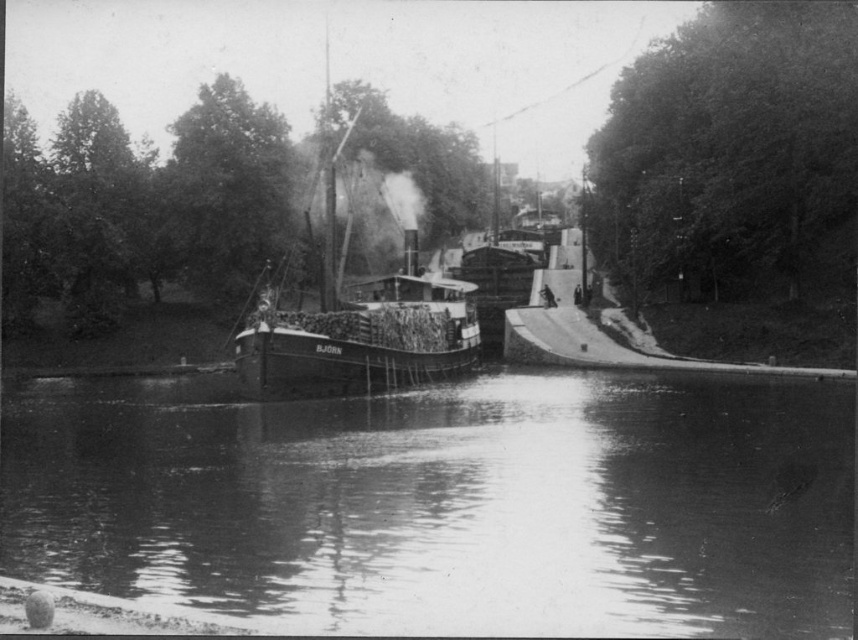
Can you confirm if smooth water at center is shorter than wooden steamboat at center?

Yes, smooth water at center is shorter than wooden steamboat at center.

Is smooth water at center taller than wooden steamboat at center?

No.

Does point (499, 397) come in front of point (335, 152)?

Yes, point (499, 397) is closer to viewer.

At what (x,y) coordinates should I click in order to perform the action: click on smooth water at center. Please return your answer as a coordinate pair (x, y). The image size is (858, 640). Looking at the image, I should click on (454, 506).